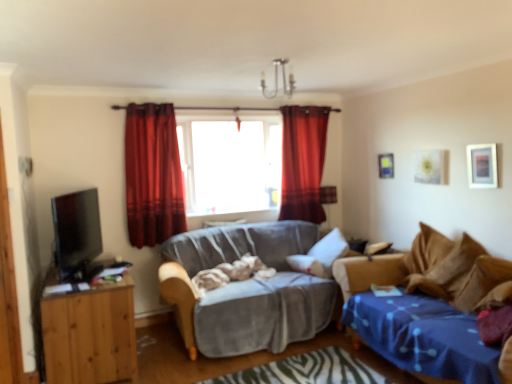
Question: Does transparent glass window at center turn towards velvet red curtain at center, marked as the 1th curtain in a left-to-right arrangement?

Choices:
 (A) no
 (B) yes

Answer: (A)

Question: Can you confirm if transparent glass window at center is wider than velvet red curtain at center, which is counted as the 2th curtain, starting from the right?

Choices:
 (A) yes
 (B) no

Answer: (A)

Question: From the image's perspective, is transparent glass window at center beneath velvet red curtain at center, marked as the 1th curtain in a left-to-right arrangement?

Choices:
 (A) yes
 (B) no

Answer: (B)

Question: Is transparent glass window at center smaller than velvet red curtain at center, which is the 1th curtain from front to back?

Choices:
 (A) yes
 (B) no

Answer: (B)

Question: Is transparent glass window at center closer to camera compared to velvet red curtain at center, which is counted as the 2th curtain, starting from the right?

Choices:
 (A) yes
 (B) no

Answer: (B)

Question: Visually, is velvet red curtain at center, marked as the 1th curtain in a left-to-right arrangement, positioned to the left or to the right of wooden cabinet at left?

Choices:
 (A) right
 (B) left

Answer: (A)

Question: Considering the positions of point (133, 193) and point (90, 321), is point (133, 193) closer or farther from the camera than point (90, 321)?

Choices:
 (A) farther
 (B) closer

Answer: (A)

Question: Based on their sizes in the image, would you say velvet red curtain at center, marked as the 1th curtain in a left-to-right arrangement, is bigger or smaller than wooden cabinet at left?

Choices:
 (A) big
 (B) small

Answer: (B)

Question: In terms of height, does velvet red curtain at center, which is counted as the 2th curtain, starting from the right, look taller or shorter compared to wooden cabinet at left?

Choices:
 (A) tall
 (B) short

Answer: (A)

Question: Considering the positions of metallic silver picture frame at upper center, marked as the first picture frame in a back-to-front arrangement, and blue fabric studio couch at right, the 2th studio couch in the left-to-right sequence, in the image, is metallic silver picture frame at upper center, marked as the first picture frame in a back-to-front arrangement, wider or thinner than blue fabric studio couch at right, the 2th studio couch in the left-to-right sequence,?

Choices:
 (A) wide
 (B) thin

Answer: (B)

Question: Considering the positions of metallic silver picture frame at upper center, the 1th picture frame from the left, and blue fabric studio couch at right, the 2th studio couch in the left-to-right sequence, in the image, is metallic silver picture frame at upper center, the 1th picture frame from the left, bigger or smaller than blue fabric studio couch at right, the 2th studio couch in the left-to-right sequence,?

Choices:
 (A) big
 (B) small

Answer: (B)

Question: Is point (378, 175) positioned closer to the camera than point (424, 254)?

Choices:
 (A) farther
 (B) closer

Answer: (A)

Question: Considering the positions of metallic silver picture frame at upper center, the 1th picture frame from the left, and blue fabric studio couch at right, the first studio couch viewed from the right, in the image, is metallic silver picture frame at upper center, the 1th picture frame from the left, taller or shorter than blue fabric studio couch at right, the first studio couch viewed from the right,?

Choices:
 (A) tall
 (B) short

Answer: (B)

Question: Is velvet red curtain at center, the 2th curtain in the back-to-front sequence, taller or shorter than velvet gray couch at center, placed as the 2th studio couch when sorted from right to left?

Choices:
 (A) tall
 (B) short

Answer: (A)

Question: From the image's perspective, is velvet red curtain at center, which is the 1th curtain from front to back, above or below velvet gray couch at center, placed as the 2th studio couch when sorted from right to left?

Choices:
 (A) above
 (B) below

Answer: (A)